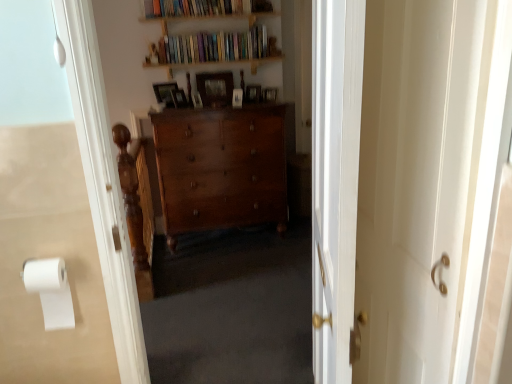
Question: Is wooden picture frame at center, the first picture frame viewed from the right, at the left side of wooden bookshelf at upper center, which ranks as the 1th book in top-to-bottom order?

Choices:
 (A) yes
 (B) no

Answer: (B)

Question: Is wooden picture frame at center, which is the sixth picture frame in left-to-right order, smaller than wooden bookshelf at upper center, which appears as the 2th book when ordered from the bottom?

Choices:
 (A) no
 (B) yes

Answer: (B)

Question: From a real-world perspective, is wooden picture frame at center, which is the sixth picture frame in left-to-right order, under wooden bookshelf at upper center, which ranks as the 1th book in top-to-bottom order?

Choices:
 (A) no
 (B) yes

Answer: (B)

Question: From the image's perspective, is wooden picture frame at center, which is the sixth picture frame in left-to-right order, beneath wooden bookshelf at upper center, which ranks as the 1th book in top-to-bottom order?

Choices:
 (A) no
 (B) yes

Answer: (B)

Question: Is wooden picture frame at center, the first picture frame viewed from the right, taller than wooden bookshelf at upper center, which ranks as the 1th book in top-to-bottom order?

Choices:
 (A) no
 (B) yes

Answer: (A)

Question: Is point (173, 57) positioned closer to the camera than point (196, 13)?

Choices:
 (A) closer
 (B) farther

Answer: (B)

Question: From a real-world perspective, relative to wooden bookshelf at upper center, which ranks as the 1th book in top-to-bottom order, is hardcover books at upper center, placed as the first book when sorted from bottom to top, vertically above or below?

Choices:
 (A) below
 (B) above

Answer: (A)

Question: From the image's perspective, is hardcover books at upper center, placed as the first book when sorted from bottom to top, above or below wooden bookshelf at upper center, which appears as the 2th book when ordered from the bottom?

Choices:
 (A) above
 (B) below

Answer: (B)

Question: Is hardcover books at upper center, the second book when ordered from top to bottom, situated inside wooden bookshelf at upper center, which appears as the 2th book when ordered from the bottom, or outside?

Choices:
 (A) inside
 (B) outside

Answer: (B)

Question: Based on their positions, is wooden picture frame at center, which is the second picture frame in left-to-right order, located to the left or right of polished wood dresser at center?

Choices:
 (A) right
 (B) left

Answer: (B)

Question: In the image, is wooden picture frame at center, which is the second picture frame in left-to-right order, positioned in front of or behind polished wood dresser at center?

Choices:
 (A) front
 (B) behind

Answer: (B)

Question: From the image's perspective, is wooden picture frame at center, which is the second picture frame in left-to-right order, above or below polished wood dresser at center?

Choices:
 (A) above
 (B) below

Answer: (A)

Question: In terms of width, does wooden picture frame at center, which is the second picture frame in left-to-right order, look wider or thinner when compared to polished wood dresser at center?

Choices:
 (A) thin
 (B) wide

Answer: (A)

Question: In the image, is wooden picture frame at center, arranged as the 4th picture frame when viewed from the right, positioned in front of or behind white matte toilet paper at left?

Choices:
 (A) front
 (B) behind

Answer: (B)

Question: Is wooden picture frame at center, the 3th picture frame in the left-to-right sequence, taller or shorter than white matte toilet paper at left?

Choices:
 (A) short
 (B) tall

Answer: (B)